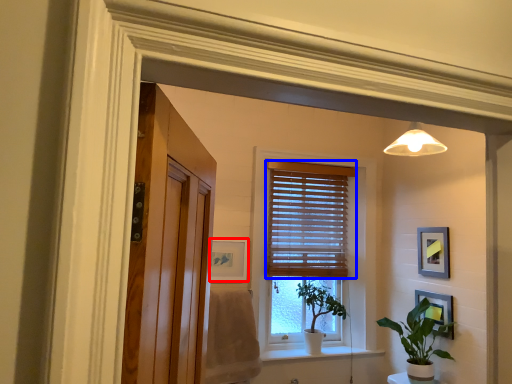
Question: Which of the following is the farthest to the observer, picture frame (highlighted by a red box) or window blind (highlighted by a blue box)?

Choices:
 (A) picture frame
 (B) window blind

Answer: (B)